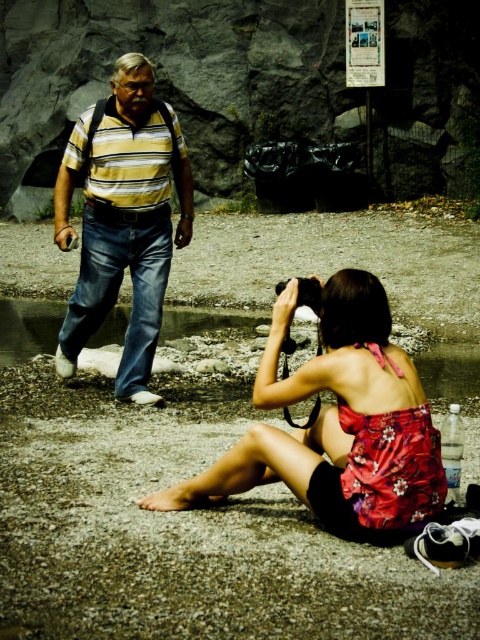
Question: Which point is farther from the camera taking this photo?

Choices:
 (A) (147, 369)
 (B) (229, 467)
 (C) (406, 500)
 (D) (310, 284)

Answer: (A)

Question: Which of the following is the closest to the observer?

Choices:
 (A) (81, 282)
 (B) (405, 484)
 (C) (389, 326)
 (D) (307, 280)

Answer: (B)

Question: Observing the image, what is the correct spatial positioning of striped cotton shirt at left in reference to floral fabric bikini top at lower center?

Choices:
 (A) left
 (B) right

Answer: (A)

Question: Is floral fabric dress at center smaller than floral fabric bikini top at lower center?

Choices:
 (A) yes
 (B) no

Answer: (B)

Question: Is floral fabric bikini top at lower center wider than black plastic camera at center?

Choices:
 (A) yes
 (B) no

Answer: (A)

Question: Estimate the real-world distances between objects in this image. Which object is closer to the striped cotton shirt at left?

Choices:
 (A) floral fabric bikini top at lower center
 (B) floral fabric dress at center
 (C) black plastic camera at center

Answer: (C)